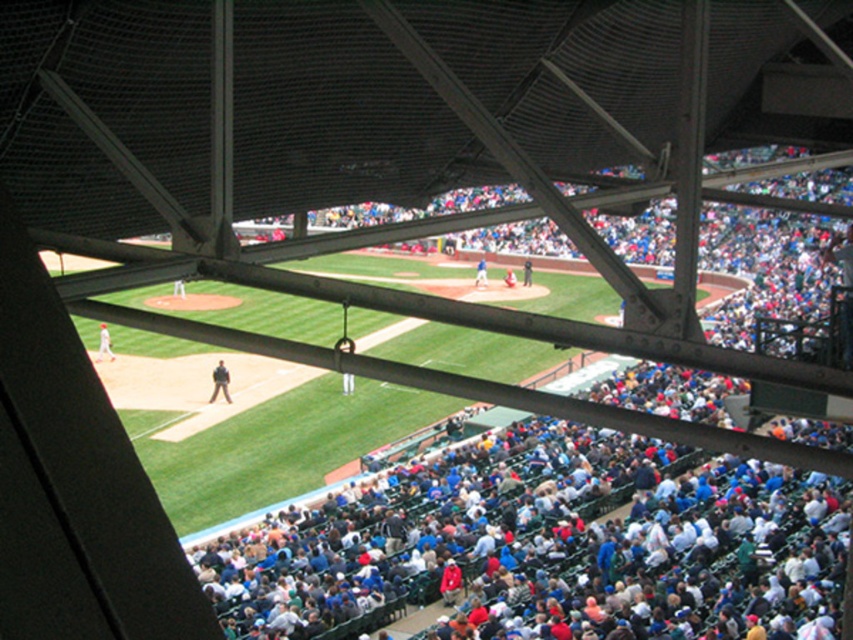
Question: From the image, what is the correct spatial relationship of red uniformed person at lower left in relation to dark blue uniform at center?

Choices:
 (A) left
 (B) right

Answer: (A)

Question: Which point appears closest to the camera in this image?

Choices:
 (A) (216, 392)
 (B) (526, 278)
 (C) (476, 278)

Answer: (A)

Question: Which object is closer to the camera taking this photo?

Choices:
 (A) red uniformed person at lower left
 (B) light brown leather jacket at center
 (C) blue jersey at center

Answer: (B)

Question: In this image, where is light brown leather jacket at center located relative to blue uniformed player at center?

Choices:
 (A) above
 (B) below

Answer: (B)

Question: Can you confirm if light brown leather jacket at center is positioned to the right of blue jersey at center?

Choices:
 (A) no
 (B) yes

Answer: (A)

Question: Estimate the real-world distances between objects in this image. Which object is closer to the dark blue uniform at center?

Choices:
 (A) light brown leather jacket at center
 (B) blue uniformed player at center
 (C) blue jersey at center

Answer: (B)